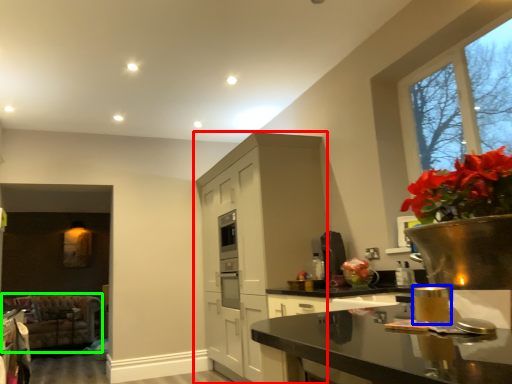
Question: Considering the real-world distances, which object is closest to cabinetry (highlighted by a red box)? candle holder (highlighted by a blue box) or armchair (highlighted by a green box).

Choices:
 (A) candle holder
 (B) armchair

Answer: (B)